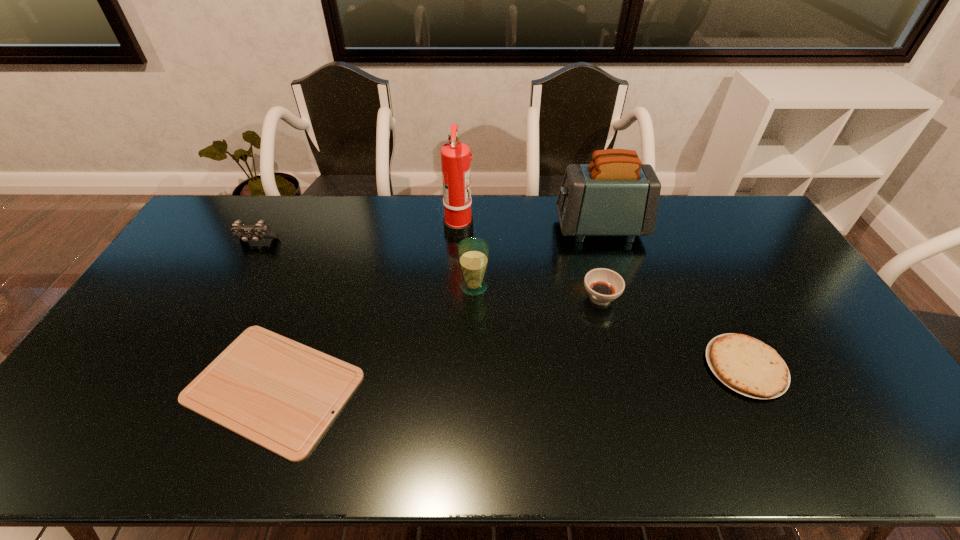
Locate an element on the screen. free point between the chopping board and the toaster is located at coordinates (437, 308).

Image resolution: width=960 pixels, height=540 pixels. What are the coordinates of `free spot between the second tallest object and the soup bowl` in the screenshot? It's located at (600, 263).

I want to click on vacant space that's between the third shortest object and the fifth shortest object, so click(538, 292).

Choose which object is the fourth nearest neighbor to the fourth tallest object. Please provide its 2D coordinates. Your answer should be formatted as a tuple, i.e. [(x, y)], where the tuple contains the x and y coordinates of a point satisfying the conditions above.

[(615, 195)]

Locate an element on the screen. Image resolution: width=960 pixels, height=540 pixels. object that can be found as the third closest to the rightmost object is located at coordinates (473, 253).

This screenshot has height=540, width=960. In order to click on free spot that satisfies the following two spatial constraints: 1. on the surface of the tortilla with buttons; 2. on the right side of the fourth shortest object in this screenshot , I will do `click(188, 367)`.

Where is `free space that satisfies the following two spatial constraints: 1. at the nozzle of the fire extinguisher; 2. on the back side of the soup bowl`? free space that satisfies the following two spatial constraints: 1. at the nozzle of the fire extinguisher; 2. on the back side of the soup bowl is located at coordinates (455, 298).

The height and width of the screenshot is (540, 960). Identify the location of vacant region that satisfies the following two spatial constraints: 1. on the front side of the third shortest object; 2. on the right side of the sixth tallest object. (618, 367).

The width and height of the screenshot is (960, 540). Identify the location of vacant space that satisfies the following two spatial constraints: 1. on the surface of the shortest object with buttons; 2. on the right side of the fourth shortest object. (178, 387).

Where is `free spot that satisfies the following two spatial constraints: 1. at the nozzle of the fire extinguisher; 2. on the right side of the soup bowl`? Image resolution: width=960 pixels, height=540 pixels. free spot that satisfies the following two spatial constraints: 1. at the nozzle of the fire extinguisher; 2. on the right side of the soup bowl is located at coordinates (455, 298).